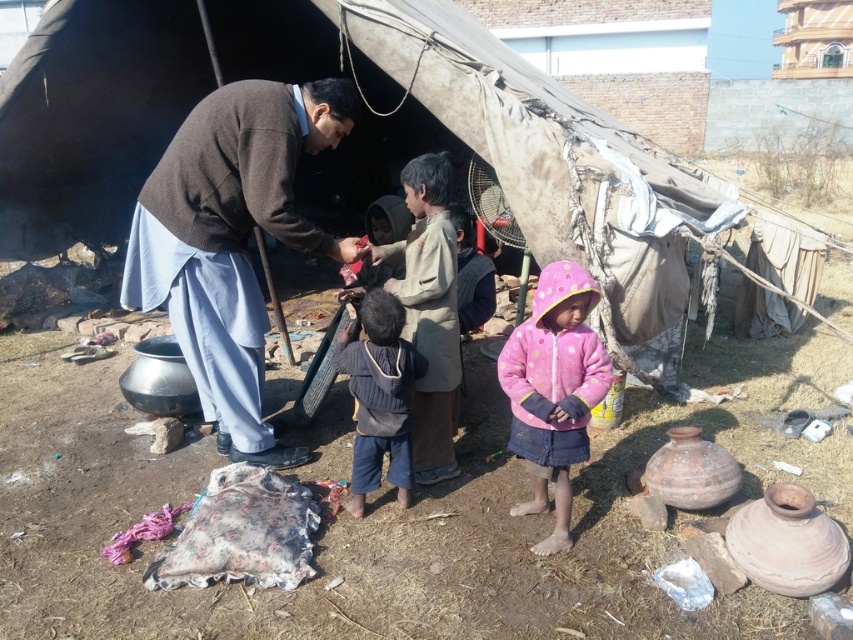
Question: Does pink fleece jacket at lower right come in front of dark blue knitted sweater at center?

Choices:
 (A) yes
 (B) no

Answer: (A)

Question: Can you confirm if pink fleece jacket at lower right is bigger than dark blue knitted sweater at center?

Choices:
 (A) yes
 (B) no

Answer: (A)

Question: Which of the following is the closest to the observer?

Choices:
 (A) dark blue knitted sweater at center
 (B) brown wool sweater at center

Answer: (A)

Question: Which point is closer to the camera?

Choices:
 (A) brown wool sweater at center
 (B) dark blue knitted sweater at center
 (C) rough canvas tent at center
 (D) pink fleece jacket at lower right

Answer: (D)

Question: Considering the relative positions of brown wool sweater at center and dark blue knitted sweater at center in the image provided, where is brown wool sweater at center located with respect to dark blue knitted sweater at center?

Choices:
 (A) left
 (B) right

Answer: (A)

Question: Which point appears closest to the camera in this image?

Choices:
 (A) (405, 506)
 (B) (560, 368)
 (C) (148, 54)
 (D) (190, 156)

Answer: (B)